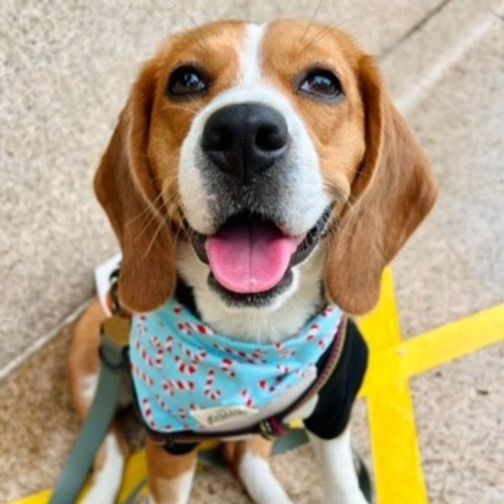
This screenshot has width=504, height=504. I want to click on white grout or filler, so click(x=23, y=358).